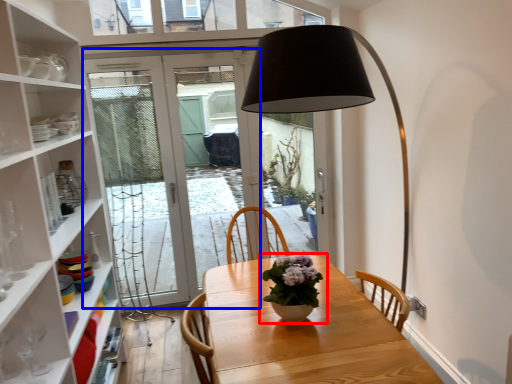
Question: Among these objects, which one is nearest to the camera, houseplant (highlighted by a red box) or door (highlighted by a blue box)?

Choices:
 (A) houseplant
 (B) door

Answer: (A)